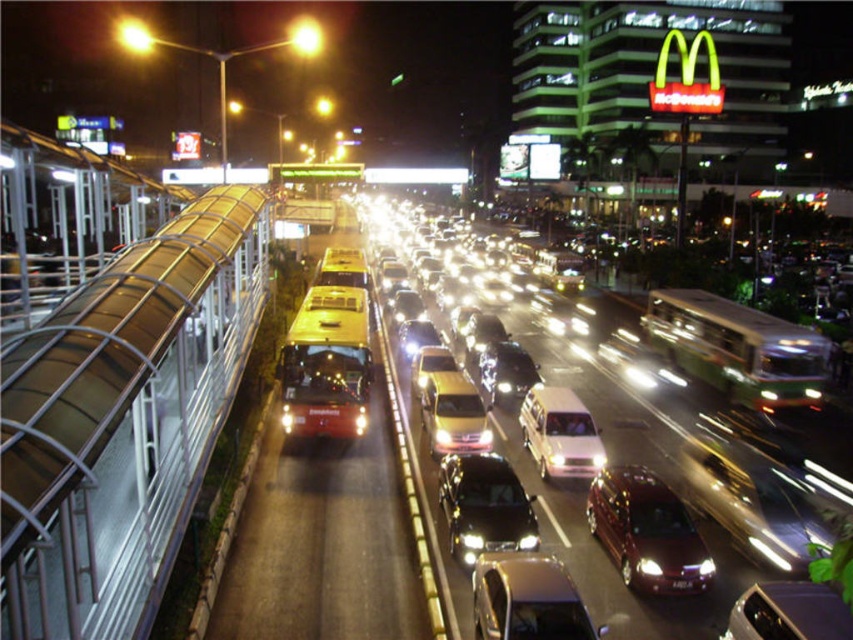
You are a pedestrian standing at the base of the pedestrian overpass on the left side of the image. You want to cross the busy road safely. The shiny black sedan at center is moving towards you. Given that the sedan is traveling at 30 km per hour, will you have enough time to cross the road before it reaches your current position?

The shiny black sedan at center is 9.08 meters away from you. At 30 km per hour, the sedan travels approximately 8.33 meters per second. To cover 9.08 meters, it would take about 1.09 seconds. Since it takes an average person around 10 seconds to cross a road, you would not have enough time to safely cross before the sedan reaches your position.

You are a pedestrian standing on the left side of the road and want to cross to the right side. You see a satin burgundy minivan at center and a white matte taxi at center. Which vehicle should you wait for to pass before proceeding?

You should wait for the satin burgundy minivan at center to pass first because it is to the right of the white matte taxi at center, meaning it is closer to your position on the left side of the road and moving towards you.

You are standing at the pedestrian overpass on the left side of the road. You want to reach a point that is exactly 30 feet away from your current position. Is the point at coordinates point (x=544, y=612) within this 30 feet range?

The distance of point (x=544, y=612) from viewer is 30.84 feet, which is slightly beyond the 30 feet range. Therefore, the point is not within the desired distance.